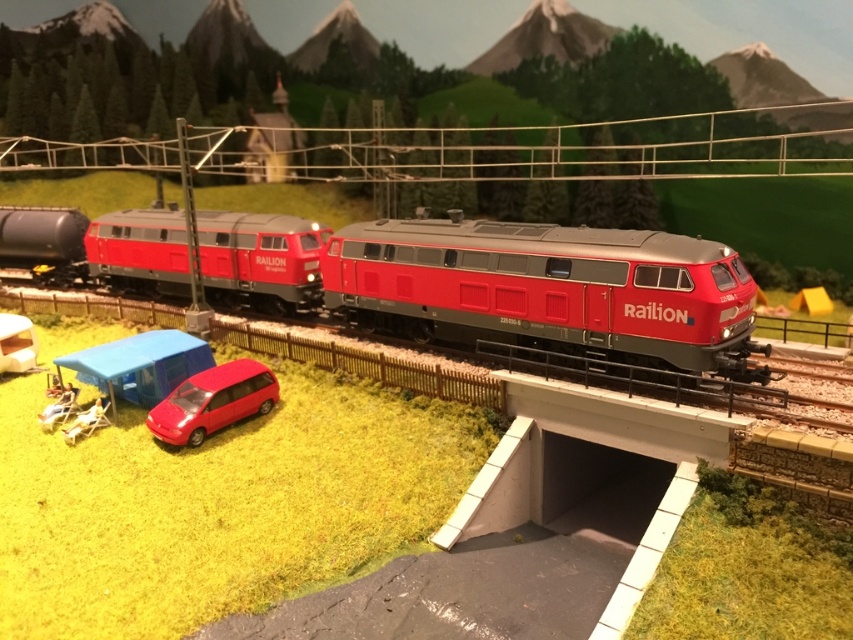
Question: Does matte red locomotive at center appear on the left side of glossy red minivan at lower center?

Choices:
 (A) no
 (B) yes

Answer: (B)

Question: Which object is closer to the camera taking this photo?

Choices:
 (A) glossy red minivan at lower center
 (B) matte red locomotive at center

Answer: (B)

Question: Can you confirm if matte red locomotive at center is positioned above glossy red minivan at lower center?

Choices:
 (A) no
 (B) yes

Answer: (B)

Question: Can you confirm if matte red locomotive at center is thinner than glossy red minivan at lower center?

Choices:
 (A) no
 (B) yes

Answer: (A)

Question: Which of the following is the farthest from the observer?

Choices:
 (A) matte red locomotive at center
 (B) glossy red minivan at lower center

Answer: (B)

Question: Which of the following is the farthest from the observer?

Choices:
 (A) (93, 224)
 (B) (200, 385)

Answer: (A)